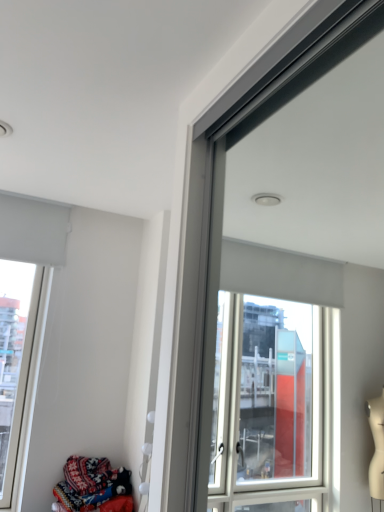
Question: Does patterned fabric at lower left have a lesser width compared to white matte window at upper left?

Choices:
 (A) no
 (B) yes

Answer: (A)

Question: Can you confirm if patterned fabric at lower left is wider than white matte window at upper left?

Choices:
 (A) yes
 (B) no

Answer: (A)

Question: From the image's perspective, does patterned fabric at lower left appear higher than white matte window at upper left?

Choices:
 (A) yes
 (B) no

Answer: (B)

Question: Is patterned fabric at lower left oriented towards white matte window at upper left?

Choices:
 (A) yes
 (B) no

Answer: (B)

Question: From the image's perspective, is patterned fabric at lower left below white matte window at upper left?

Choices:
 (A) no
 (B) yes

Answer: (B)

Question: Considering the relative sizes of patterned fabric at lower left and white matte window at upper left in the image provided, is patterned fabric at lower left smaller than white matte window at upper left?

Choices:
 (A) no
 (B) yes

Answer: (B)

Question: Is white matte window at upper left positioned behind patterned fabric at lower left?

Choices:
 (A) no
 (B) yes

Answer: (B)

Question: From the image's perspective, is white matte window at upper left beneath patterned fabric at lower left?

Choices:
 (A) yes
 (B) no

Answer: (B)

Question: Is white matte window at upper left turned away from patterned fabric at lower left?

Choices:
 (A) no
 (B) yes

Answer: (A)

Question: Could you tell me if white matte window at upper left is turned towards patterned fabric at lower left?

Choices:
 (A) no
 (B) yes

Answer: (A)

Question: Is white matte window at upper left bigger than patterned fabric at lower left?

Choices:
 (A) no
 (B) yes

Answer: (B)

Question: Can you confirm if white matte window at upper left is thinner than patterned fabric at lower left?

Choices:
 (A) yes
 (B) no

Answer: (A)

Question: Is white matte window at upper left wider or thinner than patterned fabric at lower left?

Choices:
 (A) thin
 (B) wide

Answer: (A)